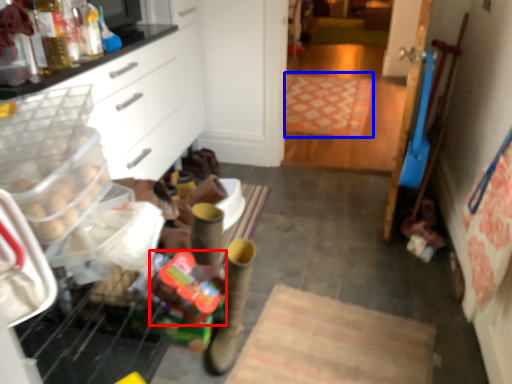
Question: Among these objects, which one is farthest to the camera, stuff (highlighted by a red box) or mat (highlighted by a blue box)?

Choices:
 (A) stuff
 (B) mat

Answer: (B)